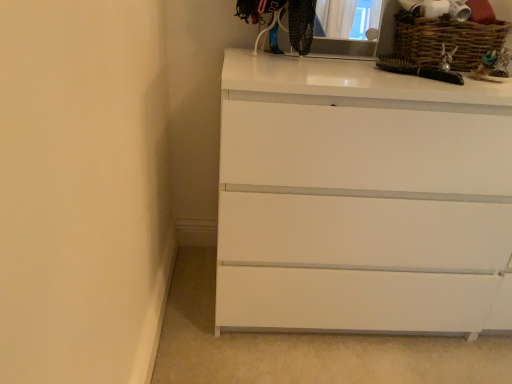
Question: From a real-world perspective, is white glossy chest of drawers at center physically located above or below matte black medicine cabinet at upper center?

Choices:
 (A) above
 (B) below

Answer: (B)

Question: Considering the positions of white glossy chest of drawers at center and matte black medicine cabinet at upper center in the image, is white glossy chest of drawers at center bigger or smaller than matte black medicine cabinet at upper center?

Choices:
 (A) big
 (B) small

Answer: (A)

Question: Considering the real-world distances, which object is farthest from the white glossy chest of drawers at center?

Choices:
 (A) woven brown basket at upper right
 (B) matte black medicine cabinet at upper center

Answer: (B)

Question: Which is nearer to the woven brown basket at upper right?

Choices:
 (A) white glossy chest of drawers at center
 (B) matte black medicine cabinet at upper center

Answer: (B)